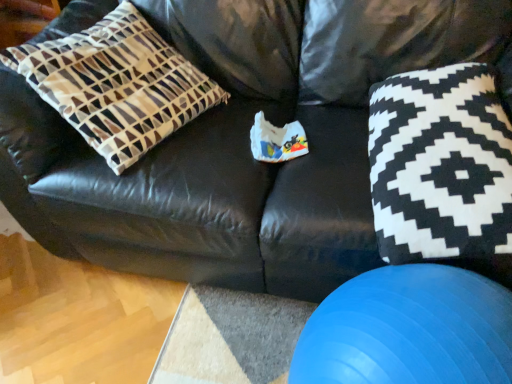
Question: Is blue rubber ball at lower right turned away from brown and white geometric pillow at left?

Choices:
 (A) yes
 (B) no

Answer: (B)

Question: Does blue rubber ball at lower right have a smaller size compared to brown and white geometric pillow at left?

Choices:
 (A) yes
 (B) no

Answer: (A)

Question: Can you confirm if blue rubber ball at lower right is positioned to the right of brown and white geometric pillow at left?

Choices:
 (A) no
 (B) yes

Answer: (B)

Question: Is blue rubber ball at lower right further to the viewer compared to brown and white geometric pillow at left?

Choices:
 (A) no
 (B) yes

Answer: (A)

Question: From a real-world perspective, does blue rubber ball at lower right stand above brown and white geometric pillow at left?

Choices:
 (A) no
 (B) yes

Answer: (A)

Question: Would you say black and white fabric pillow at right is to the left or to the right of blue rubber ball at lower right in the picture?

Choices:
 (A) left
 (B) right

Answer: (B)

Question: Is point (398, 195) closer or farther from the camera than point (403, 347)?

Choices:
 (A) closer
 (B) farther

Answer: (B)

Question: In terms of width, does black and white fabric pillow at right look wider or thinner when compared to blue rubber ball at lower right?

Choices:
 (A) wide
 (B) thin

Answer: (A)

Question: Is black and white fabric pillow at right inside or outside of blue rubber ball at lower right?

Choices:
 (A) outside
 (B) inside

Answer: (A)

Question: Is brown and white geometric pillow at left to the left or to the right of blue rubber ball at lower right in the image?

Choices:
 (A) right
 (B) left

Answer: (B)

Question: In terms of size, does brown and white geometric pillow at left appear bigger or smaller than blue rubber ball at lower right?

Choices:
 (A) small
 (B) big

Answer: (B)

Question: From a real-world perspective, is brown and white geometric pillow at left positioned above or below blue rubber ball at lower right?

Choices:
 (A) below
 (B) above

Answer: (B)

Question: Considering the positions of brown and white geometric pillow at left and blue rubber ball at lower right in the image, is brown and white geometric pillow at left wider or thinner than blue rubber ball at lower right?

Choices:
 (A) thin
 (B) wide

Answer: (B)

Question: Would you say blue rubber ball at lower right is inside or outside brown and white geometric pillow at left?

Choices:
 (A) inside
 (B) outside

Answer: (B)

Question: Is point click(x=466, y=377) positioned closer to the camera than point click(x=105, y=107)?

Choices:
 (A) closer
 (B) farther

Answer: (A)